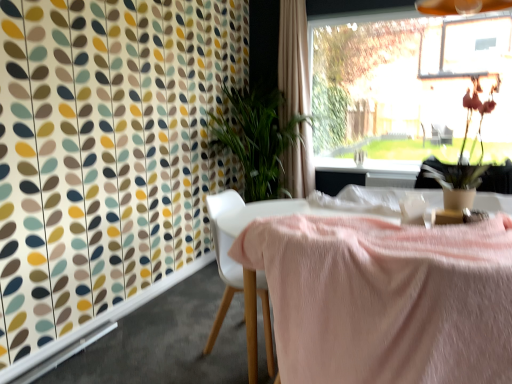
Find the location of a particular element. The height and width of the screenshot is (384, 512). pink fabric-covered table at center is located at coordinates (384, 297).

Image resolution: width=512 pixels, height=384 pixels. Identify the location of transparent glass window at upper right. (407, 85).

Identify the location of matte brown vase with dried flowers at upper right. The image size is (512, 384). (463, 156).

The width and height of the screenshot is (512, 384). Find the location of `white plastic chair at center`. white plastic chair at center is located at coordinates (244, 268).

Find the location of a particular element. Image resolution: width=512 pixels, height=384 pixels. pink fabric-covered table at center is located at coordinates (384, 297).

Which is in front, white plastic chair at center or beige fabric curtain at upper center?

white plastic chair at center is closer to the camera.

Is white plastic chair at center not within beige fabric curtain at upper center?

Absolutely, white plastic chair at center is external to beige fabric curtain at upper center.

From a real-world perspective, which object stands above the other?

From a 3D spatial view, beige fabric curtain at upper center is above.

Can you confirm if white plastic chair at center is bigger than beige fabric curtain at upper center?

Answer: No, white plastic chair at center is not bigger than beige fabric curtain at upper center.

Based on the photo, what's the angular difference between white plastic chair at center and pink fabric-covered table at center's facing directions?

88.7 degrees separate the facing orientations of white plastic chair at center and pink fabric-covered table at center.

Does white plastic chair at center lie behind pink fabric-covered table at center?

That is True.

Does point (256, 339) come in front of point (475, 364)?

No, it is behind (475, 364).

This screenshot has width=512, height=384. In order to click on chair above the pink fabric-covered table at center (from a real-world perspective) in this screenshot , I will do `click(244, 268)`.

Is there a large distance between pink fabric-covered table at center and matte brown vase with dried flowers at upper right?

That's not correct — pink fabric-covered table at center is a little close to matte brown vase with dried flowers at upper right.

Is pink fabric-covered table at center not within matte brown vase with dried flowers at upper right?

Absolutely, pink fabric-covered table at center is external to matte brown vase with dried flowers at upper right.

Is pink fabric-covered table at center thinner than matte brown vase with dried flowers at upper right?

No.

Can you confirm if pink fabric-covered table at center is shorter than matte brown vase with dried flowers at upper right?

In fact, pink fabric-covered table at center may be taller than matte brown vase with dried flowers at upper right.

Which object is positioned more to the right, beige fabric curtain at upper center or pink fabric-covered table at center?

From the viewer's perspective, pink fabric-covered table at center appears more on the right side.

Is beige fabric curtain at upper center next to pink fabric-covered table at center?

They are not placed beside each other.

How many degrees apart are the facing directions of beige fabric curtain at upper center and pink fabric-covered table at center?

The angle between the facing direction of beige fabric curtain at upper center and the facing direction of pink fabric-covered table at center is 0.544 degrees.

From the image's perspective, is beige fabric curtain at upper center located beneath pink fabric-covered table at center?

No, from the image's perspective, beige fabric curtain at upper center is not below pink fabric-covered table at center.

Measure the distance from transparent glass window at upper right to white plastic chair at center.

transparent glass window at upper right is 3.50 meters from white plastic chair at center.

Who is taller, transparent glass window at upper right or white plastic chair at center?

transparent glass window at upper right is taller.

Considering the sizes of transparent glass window at upper right and white plastic chair at center in the image, is transparent glass window at upper right bigger or smaller than white plastic chair at center?

transparent glass window at upper right is bigger than white plastic chair at center.

From a real-world perspective, is transparent glass window at upper right over white plastic chair at center?

Indeed, from a real-world perspective, transparent glass window at upper right stands above white plastic chair at center.

Would you say pink fabric-covered table at center is to the left or to the right of transparent glass window at upper right in the picture?

From the image, it's evident that pink fabric-covered table at center is to the left of transparent glass window at upper right.

Considering the relative sizes of pink fabric-covered table at center and transparent glass window at upper right in the image provided, is pink fabric-covered table at center shorter than transparent glass window at upper right?

Yes, pink fabric-covered table at center is shorter than transparent glass window at upper right.

Would you say pink fabric-covered table at center is outside transparent glass window at upper right?

Indeed, pink fabric-covered table at center is completely outside transparent glass window at upper right.

Is pink fabric-covered table at center smaller than transparent glass window at upper right?

Actually, pink fabric-covered table at center might be larger than transparent glass window at upper right.

Considering the relative sizes of transparent glass window at upper right and matte brown vase with dried flowers at upper right in the image provided, is transparent glass window at upper right thinner than matte brown vase with dried flowers at upper right?

Yes.

Is point (470, 141) behind point (471, 169)?

Yes.

Is transparent glass window at upper right positioned beyond the bounds of matte brown vase with dried flowers at upper right?

Yes, transparent glass window at upper right is not within matte brown vase with dried flowers at upper right.

Considering the sizes of objects transparent glass window at upper right and matte brown vase with dried flowers at upper right in the image provided, who is smaller, transparent glass window at upper right or matte brown vase with dried flowers at upper right?

With smaller size is matte brown vase with dried flowers at upper right.

In order to click on chair below the beige fabric curtain at upper center (from a real-world perspective) in this screenshot , I will do `click(244, 268)`.

Identify the location of chair behind the pink fabric-covered table at center. This screenshot has height=384, width=512. (244, 268).

Estimate the real-world distances between objects in this image. Which object is closer to white plastic chair at center, matte brown vase with dried flowers at upper right or pink fabric-covered table at center?

pink fabric-covered table at center is closer to white plastic chair at center.

Which object lies nearer to the anchor point white plastic chair at center, transparent glass window at upper right or matte brown vase with dried flowers at upper right?

Based on the image, matte brown vase with dried flowers at upper right appears to be nearer to white plastic chair at center.

Based on their spatial positions, is pink fabric-covered table at center or white plastic chair at center closer to beige fabric curtain at upper center?

white plastic chair at center.

Looking at the image, which one is located further to pink fabric-covered table at center, white plastic chair at center or transparent glass window at upper right?

Among the two, transparent glass window at upper right is located further to pink fabric-covered table at center.

Which object lies nearer to the anchor point matte brown vase with dried flowers at upper right, beige fabric curtain at upper center or pink fabric-covered table at center?

pink fabric-covered table at center is positioned closer to the anchor matte brown vase with dried flowers at upper right.

Estimate the real-world distances between objects in this image. Which object is further from beige fabric curtain at upper center, matte brown vase with dried flowers at upper right or transparent glass window at upper right?

The object further to beige fabric curtain at upper center is transparent glass window at upper right.

Looking at the image, which one is located closer to beige fabric curtain at upper center, transparent glass window at upper right or white plastic chair at center?

white plastic chair at center is positioned closer to the anchor beige fabric curtain at upper center.

When comparing their distances from pink fabric-covered table at center, does matte brown vase with dried flowers at upper right or beige fabric curtain at upper center seem closer?

matte brown vase with dried flowers at upper right.

At what (x,y) coordinates should I click in order to perform the action: click on table located between white plastic chair at center and matte brown vase with dried flowers at upper right in the left-right direction. Please return your answer as a coordinate pair (x, y). The height and width of the screenshot is (384, 512). Looking at the image, I should click on (384, 297).

Locate an element on the screen. This screenshot has width=512, height=384. window positioned between pink fabric-covered table at center and beige fabric curtain at upper center from near to far is located at coordinates (407, 85).

You are a GUI agent. You are given a task and a screenshot of the screen. Output one action in this format:
    pyautogui.click(x=<x>, y=<y>)
    Task: Click on the floral arrangement between pink fabric-covered table at center and beige fabric curtain at upper center along the z-axis
    
    Given the screenshot: What is the action you would take?
    pyautogui.click(x=463, y=156)

Find the location of `window positioned between white plastic chair at center and beige fabric curtain at upper center from near to far`. window positioned between white plastic chair at center and beige fabric curtain at upper center from near to far is located at coordinates (407, 85).